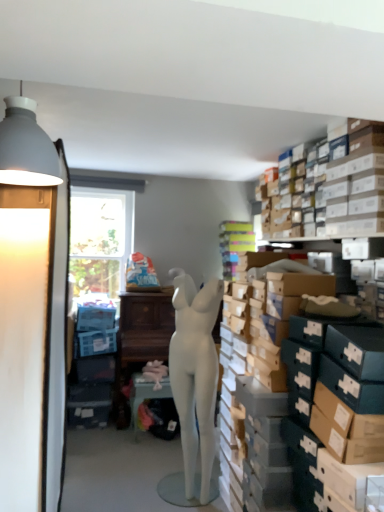
Question: Is matte white table at center taller or shorter than white matte lampshade at upper left?

Choices:
 (A) short
 (B) tall

Answer: (B)

Question: In terms of width, does matte white table at center look wider or thinner when compared to white matte lampshade at upper left?

Choices:
 (A) thin
 (B) wide

Answer: (B)

Question: Which is nearer to the matte white lampshade at left?

Choices:
 (A) white matte mannequin at center
 (B) matte white table at center
 (C) white matte lampshade at upper left

Answer: (C)

Question: Which of these objects is positioned closest to the white matte mannequin at center?

Choices:
 (A) white matte lampshade at upper left
 (B) matte white lampshade at left
 (C) matte white table at center

Answer: (C)